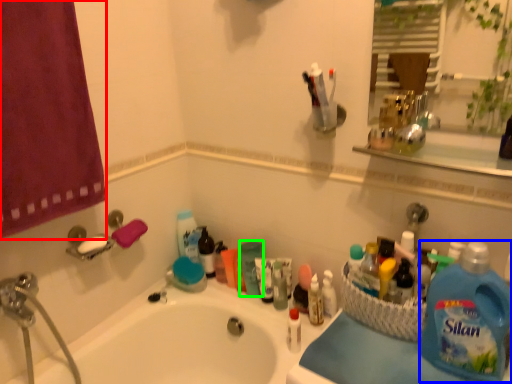
Question: Which is nearer to the shower curtain (highlighted by a red box)? cleaning product (highlighted by a blue box) or cleaning product (highlighted by a green box).

Choices:
 (A) cleaning product
 (B) cleaning product

Answer: (B)